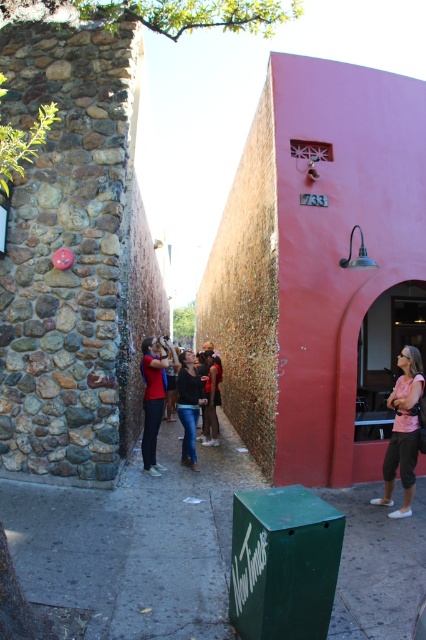
Question: Can you confirm if green painted concrete pavement at center is positioned below pink fabric at center?

Choices:
 (A) no
 (B) yes

Answer: (B)

Question: Is the position of matte red shirt at center more distant than that of denim jeans at center?

Choices:
 (A) no
 (B) yes

Answer: (A)

Question: Estimate the real-world distances between objects in this image. Which object is closer to the denim jeans at center?

Choices:
 (A) matte red shirt at center
 (B) dark blue jeans at center
 (C) green painted concrete pavement at center
 (D) pink fabric at center

Answer: (A)

Question: Which object is the closest to the matte red shirt at center?

Choices:
 (A) pink fabric at center
 (B) dark blue jeans at center
 (C) green painted concrete pavement at center
 (D) denim jeans at center

Answer: (D)

Question: Which of the following is the closest to the observer?

Choices:
 (A) (186, 413)
 (B) (141, 372)
 (C) (123, 637)
 (D) (400, 397)

Answer: (C)

Question: Is matte red shirt at center bigger than dark blue jeans at center?

Choices:
 (A) yes
 (B) no

Answer: (B)